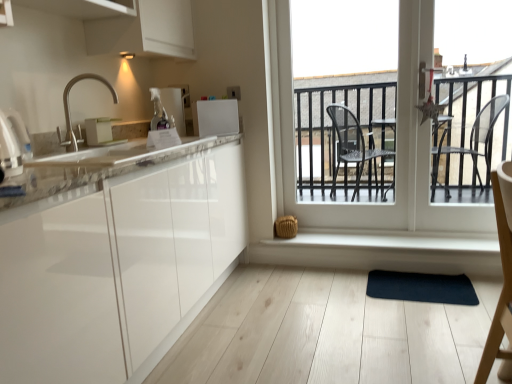
What do you see at coordinates (100, 132) in the screenshot? This screenshot has width=512, height=384. I see `matte white toaster at upper left, placed as the 3th appliance when sorted from right to left` at bounding box center [100, 132].

How much space does white glossy microwave at upper center, acting as the third appliance starting from the front, occupy vertically?

white glossy microwave at upper center, acting as the third appliance starting from the front, is 23.42 centimeters in height.

Image resolution: width=512 pixels, height=384 pixels. What do you see at coordinates (421, 287) in the screenshot?
I see `dark blue rubber yoga mat at center` at bounding box center [421, 287].

You are a GUI agent. You are given a task and a screenshot of the screen. Output one action in this format:
    pyautogui.click(x=<x>, y=<y>)
    Task: Click on the transparent glass door at center
    
    Given the screenshot: What is the action you would take?
    pyautogui.click(x=397, y=140)

This screenshot has height=384, width=512. What do you see at coordinates (397, 140) in the screenshot?
I see `transparent glass door at center` at bounding box center [397, 140].

You are a GUI agent. You are given a task and a screenshot of the screen. Output one action in this format:
    pyautogui.click(x=<x>, y=<y>)
    Task: Click on the matte white toaster at upper left, the 3th appliance viewed from the back
    The height and width of the screenshot is (384, 512).
    Given the screenshot: What is the action you would take?
    pyautogui.click(x=100, y=132)

Locate an element on the screen. The image size is (512, 384). appliance that is the 2nd object directly below the metallic silver toaster at upper center, the 1th appliance from the back (from a real-world perspective) is located at coordinates (13, 143).

Does white glossy electric kettle at left, acting as the fourth appliance starting from the back, appear on the left side of metallic silver toaster at upper center, which is the third appliance in left-to-right order?

Indeed, white glossy electric kettle at left, acting as the fourth appliance starting from the back, is positioned on the left side of metallic silver toaster at upper center, which is the third appliance in left-to-right order.

Is white glossy electric kettle at left, the 1th appliance when ordered from left to right, bigger than metallic silver toaster at upper center, which is the fourth appliance in front-to-back order?

Yes, white glossy electric kettle at left, the 1th appliance when ordered from left to right, is bigger than metallic silver toaster at upper center, which is the fourth appliance in front-to-back order.

Considering the sizes of objects white glossy electric kettle at left, the 1th appliance when ordered from left to right, and metallic silver toaster at upper center, which is the fourth appliance in front-to-back order, in the image provided, who is thinner, white glossy electric kettle at left, the 1th appliance when ordered from left to right, or metallic silver toaster at upper center, which is the fourth appliance in front-to-back order,?

With smaller width is metallic silver toaster at upper center, which is the fourth appliance in front-to-back order.

From the picture: From a real-world perspective, is white matte window sill at lower center physically below metallic silver toaster at upper center, the second appliance from the right?

Yes, from a real-world perspective, white matte window sill at lower center is beneath metallic silver toaster at upper center, the second appliance from the right.

Is point (333, 235) positioned in front of point (181, 126)?

No.

Can you confirm if white glossy electric kettle at left, the 1th appliance when ordered from left to right, is bigger than matte white toaster at upper left, placed as the 3th appliance when sorted from right to left?

Correct, white glossy electric kettle at left, the 1th appliance when ordered from left to right, is larger in size than matte white toaster at upper left, placed as the 3th appliance when sorted from right to left.

Does white glossy electric kettle at left, which is the 4th appliance in right-to-left order, have a greater width compared to matte white toaster at upper left, positioned as the second appliance in left-to-right order?

Yes.

Is white glossy electric kettle at left, acting as the fourth appliance starting from the back, oriented away from matte white toaster at upper left, placed as the 3th appliance when sorted from right to left?

white glossy electric kettle at left, acting as the fourth appliance starting from the back, does not have its back to matte white toaster at upper left, placed as the 3th appliance when sorted from right to left.

From the image's perspective, which one is positioned higher, satin nickel faucet at upper left or metallic silver toaster at upper center, the 1th appliance from the back?

metallic silver toaster at upper center, the 1th appliance from the back, appears higher in the image.

Where is `the 3rd appliance behind when counting from the satin nickel faucet at upper left`? the 3rd appliance behind when counting from the satin nickel faucet at upper left is located at coordinates (170, 105).

From a real-world perspective, is satin nickel faucet at upper left located higher than metallic silver toaster at upper center, the second appliance from the right?

Yes, from a real-world perspective, satin nickel faucet at upper left is above metallic silver toaster at upper center, the second appliance from the right.

Would you say satin nickel faucet at upper left is a long distance from metallic silver toaster at upper center, the 1th appliance from the back?

No, there isn't a large distance between satin nickel faucet at upper left and metallic silver toaster at upper center, the 1th appliance from the back.

From a real-world perspective, is satin nickel faucet at upper left positioned above or below white glossy microwave at upper center, the 2th appliance positioned from the back?

satin nickel faucet at upper left is situated higher than white glossy microwave at upper center, the 2th appliance positioned from the back, in the real world.

Who is shorter, satin nickel faucet at upper left or white glossy microwave at upper center, the 2th appliance positioned from the back?

Standing shorter between the two is white glossy microwave at upper center, the 2th appliance positioned from the back.

Is satin nickel faucet at upper left in front of white glossy microwave at upper center, which is the fourth appliance from left to right?

Yes, it is in front of white glossy microwave at upper center, which is the fourth appliance from left to right.

Can you confirm if satin nickel faucet at upper left is thinner than white glossy microwave at upper center, arranged as the 1th appliance when viewed from the right?

No, satin nickel faucet at upper left is not thinner than white glossy microwave at upper center, arranged as the 1th appliance when viewed from the right.

Considering the points (414, 297) and (6, 159), which point is behind, point (414, 297) or point (6, 159)?

The point (414, 297) is behind.

Locate an element on the screen. the 4th appliance counting from the left side of the dark blue rubber yoga mat at center is located at coordinates (13, 143).

Does dark blue rubber yoga mat at center come behind white glossy electric kettle at left, the 1th appliance when ordered from left to right?

Yes, it is behind white glossy electric kettle at left, the 1th appliance when ordered from left to right.

How many degrees apart are the facing directions of dark blue rubber yoga mat at center and white glossy electric kettle at left, the 1th appliance when ordered from left to right?

The facing directions of dark blue rubber yoga mat at center and white glossy electric kettle at left, the 1th appliance when ordered from left to right, are 98 degrees apart.

Which of these two, white glossy countertop at left or transparent glass door at center, is smaller?

Smaller between the two is white glossy countertop at left.

Which object is closer to the camera, white glossy countertop at left or transparent glass door at center?

white glossy countertop at left.

From a real-world perspective, is white glossy countertop at left positioned over transparent glass door at center based on gravity?

Incorrect, from a real-world perspective, white glossy countertop at left is lower than transparent glass door at center.

I want to click on appliance that is the 3rd object located in front of the metallic silver toaster at upper center, the 1th appliance from the back, so click(13, 143).

You are a GUI agent. You are given a task and a screenshot of the screen. Output one action in this format:
    pyautogui.click(x=<x>, y=<y>)
    Task: Click on the appliance that is the 4th object located above the white matte window sill at lower center (from the image's perspective)
    Image resolution: width=512 pixels, height=384 pixels.
    Given the screenshot: What is the action you would take?
    pyautogui.click(x=170, y=105)

Based on their spatial positions, is matte white toaster at upper left, the 3th appliance viewed from the back, or transparent glass door at center further from satin nickel faucet at upper left?

The object further to satin nickel faucet at upper left is transparent glass door at center.

Based on their spatial positions, is transparent glass door at center or satin nickel faucet at upper left closer to white glossy microwave at upper center, the 2th appliance positioned from the back?

satin nickel faucet at upper left.

In the scene shown: From the image, which object appears to be nearer to white matte window sill at lower center, satin nickel faucet at upper left or transparent glass door at center?

transparent glass door at center is positioned closer to the anchor white matte window sill at lower center.

When comparing their distances from transparent glass door at center, does dark blue rubber yoga mat at center or white glossy microwave at upper center, acting as the third appliance starting from the front, seem further?

Based on the image, white glossy microwave at upper center, acting as the third appliance starting from the front, appears to be further to transparent glass door at center.

Consider the image. Based on their spatial positions, is white matte window sill at lower center or satin nickel faucet at upper left further from white glossy microwave at upper center, acting as the third appliance starting from the front?

Based on the image, white matte window sill at lower center appears to be further to white glossy microwave at upper center, acting as the third appliance starting from the front.

From the image, which object appears to be farther from matte white toaster at upper left, placed as the 3th appliance when sorted from right to left, white glossy microwave at upper center, which is the fourth appliance from left to right, or white glossy countertop at left?

The object further to matte white toaster at upper left, placed as the 3th appliance when sorted from right to left, is white glossy countertop at left.

Which object lies nearer to the anchor point white matte window sill at lower center, white glossy electric kettle at left, acting as the first appliance starting from the front, or dark blue rubber yoga mat at center?

The object closer to white matte window sill at lower center is dark blue rubber yoga mat at center.

Estimate the real-world distances between objects in this image. Which object is further from white glossy microwave at upper center, which is the fourth appliance from left to right, metallic silver toaster at upper center, which is the third appliance in left-to-right order, or white glossy electric kettle at left, which is the 4th appliance in right-to-left order?

Based on the image, white glossy electric kettle at left, which is the 4th appliance in right-to-left order, appears to be further to white glossy microwave at upper center, which is the fourth appliance from left to right.

I want to click on tap between white glossy electric kettle at left, which is the 4th appliance in right-to-left order, and white glossy microwave at upper center, the 2th appliance positioned from the back, from front to back, so click(69, 110).

Locate an element on the screen. countertop located between satin nickel faucet at upper left and white matte window sill at lower center in the left-right direction is located at coordinates (96, 170).

Where is `countertop between white glossy electric kettle at left, the 1th appliance when ordered from left to right, and white glossy microwave at upper center, which is the fourth appliance from left to right, from front to back`? The image size is (512, 384). countertop between white glossy electric kettle at left, the 1th appliance when ordered from left to right, and white glossy microwave at upper center, which is the fourth appliance from left to right, from front to back is located at coordinates (96, 170).

This screenshot has width=512, height=384. I want to click on countertop located between white glossy electric kettle at left, acting as the first appliance starting from the front, and satin nickel faucet at upper left in the depth direction, so click(96, 170).